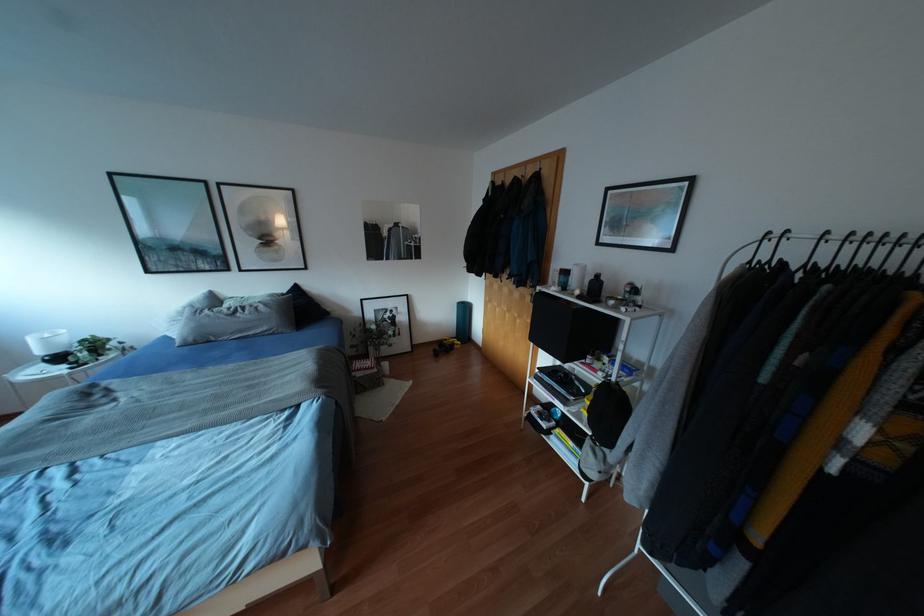
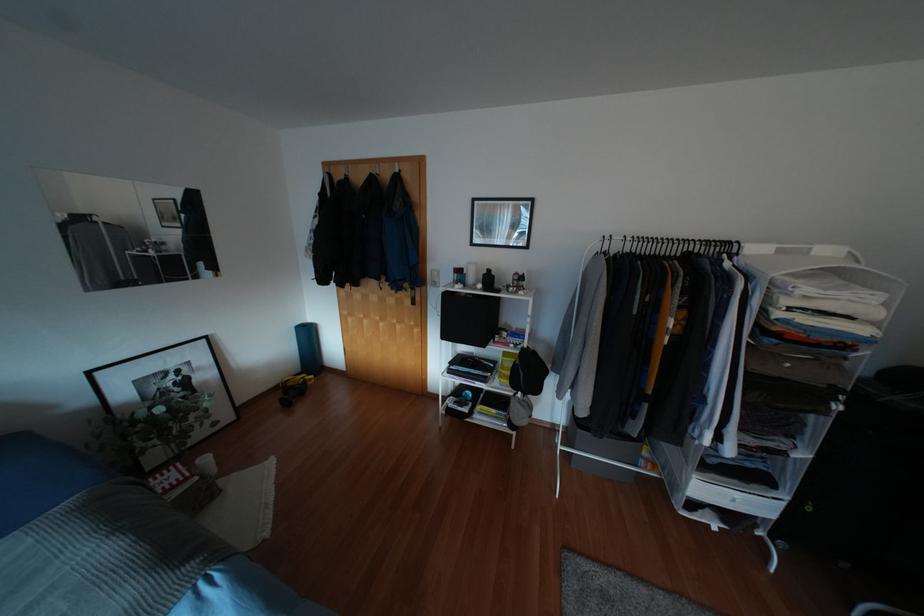
In the second image, find the point that corresponds to the point at 384,363 in the first image.

(205, 459)